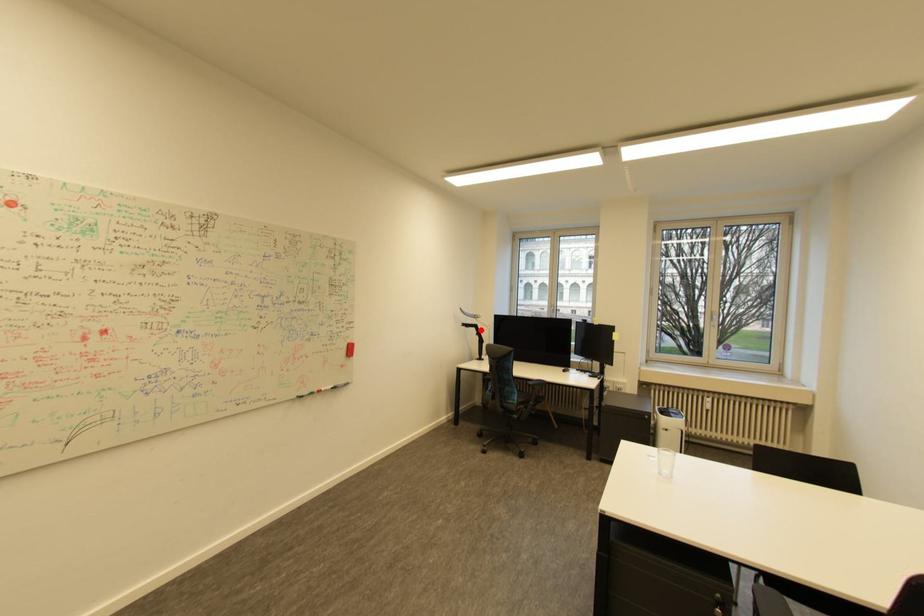
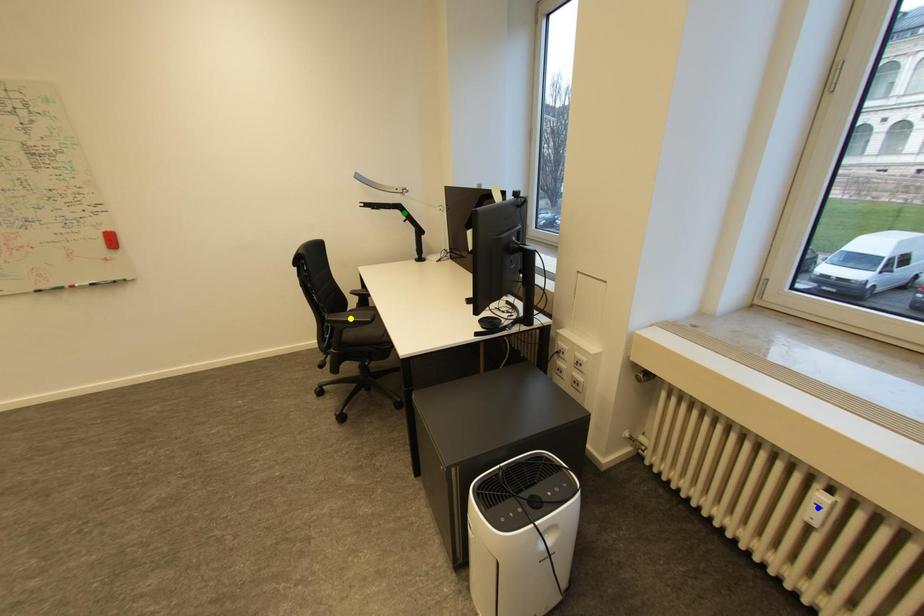
Question: I am providing you with two images of the same scene from different viewpoints. A red point is marked on the first image. You are given multiple points on the second image. In image 2, which mark is for the same physical point as the one in image 1?

Choices:
 (A) yellow point
 (B) green point
 (C) blue point

Answer: (B)